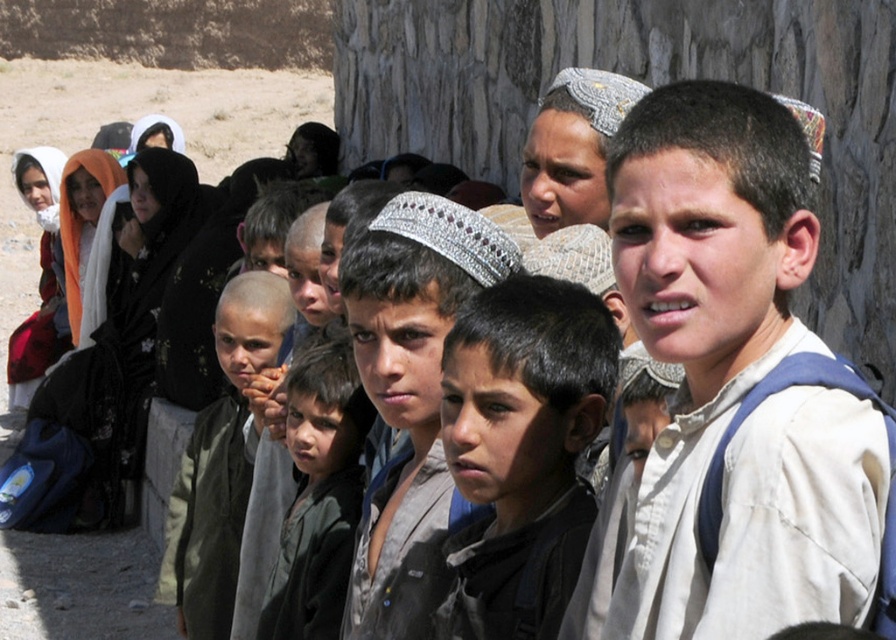
You are a photographer trying to capture a closeup of the dark brown hair at center and the shiny silver headband at center. Which object would require a wider lens to capture fully in the frame?

The dark brown hair at center has a larger width than the shiny silver headband at center, so it would require a wider lens to capture fully in the frame.

You are a photographer trying to capture a group photo of the dark brown hair at center and the silver textured headband at center. The camera you are using has a maximum focus range of 5 meters. Will you be able to capture both subjects clearly in the same photo?

The dark brown hair at center and the silver textured headband at center are 6.26 meters apart, which exceeds the camera maximum focus range of 5 meters. Therefore, you cannot capture both subjects clearly in the same photo.